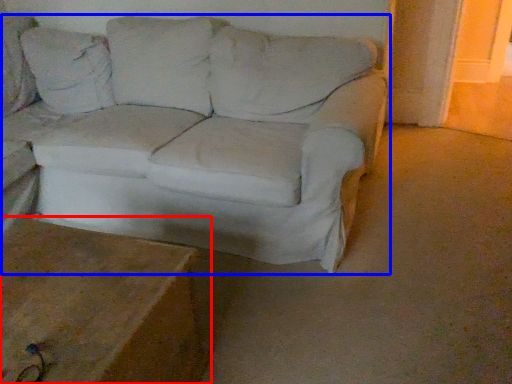
Question: Which of the following is the farthest to the observer, table (highlighted by a red box) or studio couch (highlighted by a blue box)?

Choices:
 (A) table
 (B) studio couch

Answer: (B)